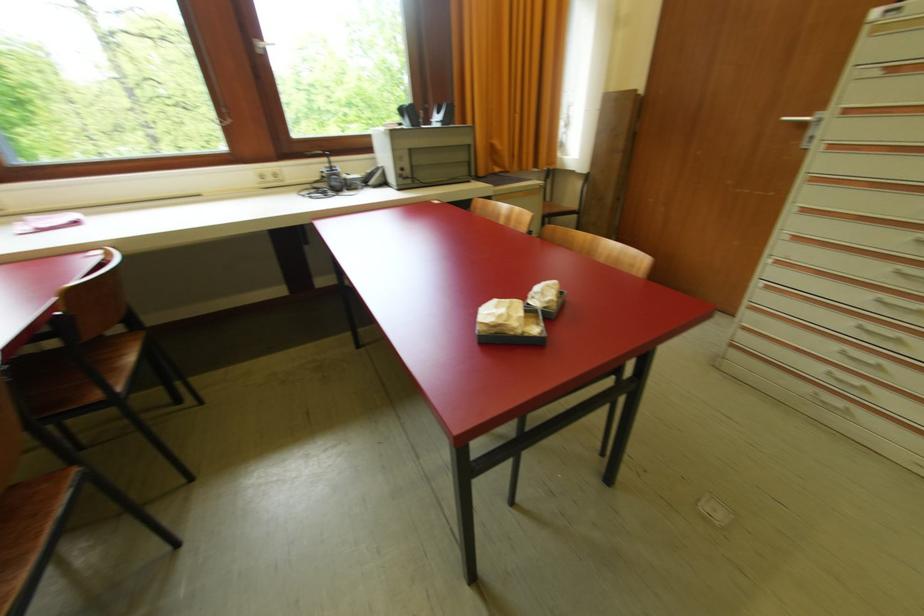
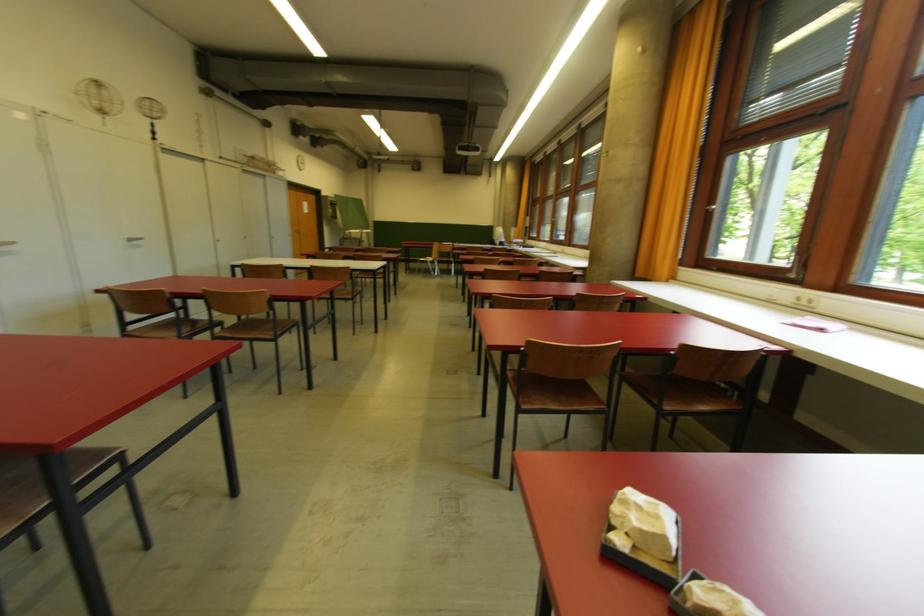
Where in the second image is the point corresponding to point 132,361 from the first image?

(706, 410)